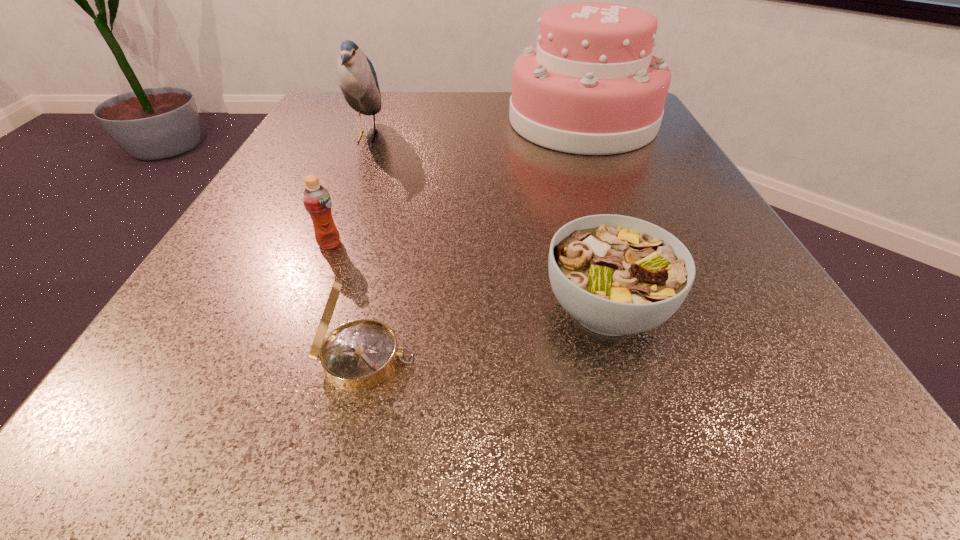
Locate an element on the screen. birthday cake is located at coordinates (591, 86).

You are a GUI agent. You are given a task and a screenshot of the screen. Output one action in this format:
    pyautogui.click(x=<x>, y=<y>)
    Task: Click on the bird
    The width and height of the screenshot is (960, 540).
    Given the screenshot: What is the action you would take?
    pyautogui.click(x=358, y=82)

Find the location of a particular element. orange juice is located at coordinates (317, 201).

The image size is (960, 540). I want to click on compass, so click(x=358, y=355).

This screenshot has width=960, height=540. I want to click on soup bowl, so click(x=616, y=275).

The width and height of the screenshot is (960, 540). I want to click on vacant space situated on the left of the birthday cake, so click(x=347, y=121).

At what (x,y) coordinates should I click in order to perform the action: click on free space located at the tip of the bird's beak. Please return your answer as a coordinate pair (x, y). This screenshot has width=960, height=540. Looking at the image, I should click on (445, 137).

Identify the location of vacant space located 0.180m on the back of the third nearest object. The image size is (960, 540). (356, 176).

I want to click on free region located 0.250m with the dial facing the third object from right to left, so (x=632, y=359).

Locate an element on the screen. This screenshot has width=960, height=540. free spot located 0.050m on the right of the soup bowl is located at coordinates (708, 309).